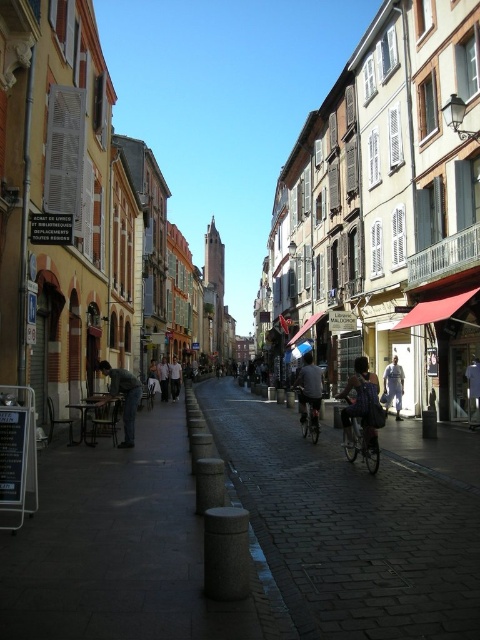
Is point (300, 420) positioned behind point (308, 397)?

Yes.

Is dark gray fabric jacket at center smaller than silver metallic bicycle at center?

No.

What do you see at coordinates (309, 387) in the screenshot?
I see `dark gray fabric jacket at center` at bounding box center [309, 387].

In order to click on dark gray fabric jacket at center in this screenshot , I will do `click(309, 387)`.

Which is below, light beige shirt at center or light brown leather jacket at center?

→ light beige shirt at center

Is light beige shirt at center wider than light brown leather jacket at center?

Correct, the width of light beige shirt at center exceeds that of light brown leather jacket at center.

I want to click on light beige shirt at center, so click(175, 378).

How distant is metallic silver bicycle at center from light brown leather jacket at center?

metallic silver bicycle at center and light brown leather jacket at center are 171.99 feet apart from each other.

Looking at this image, can you confirm if metallic silver bicycle at center is shorter than light brown leather jacket at center?

Incorrect, metallic silver bicycle at center's height does not fall short of light brown leather jacket at center's.

Describe the element at coordinates (361, 445) in the screenshot. The width and height of the screenshot is (480, 640). I see `metallic silver bicycle at center` at that location.

I want to click on metallic silver bicycle at center, so click(x=361, y=445).